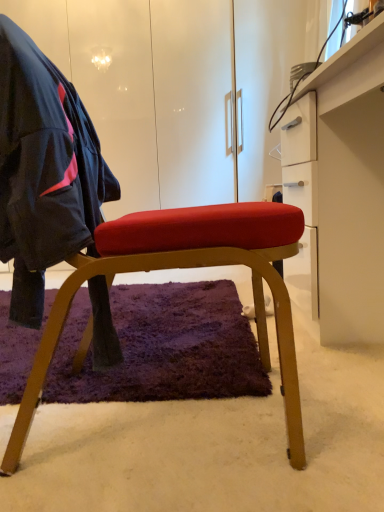
Question: Does point (54, 252) appear closer or farther from the camera than point (41, 223)?

Choices:
 (A) farther
 (B) closer

Answer: (A)

Question: Relative to matte wood chair at center, is matte black jacket at left in front or behind?

Choices:
 (A) behind
 (B) front

Answer: (B)

Question: Which of these objects is positioned farthest from the matte wood chair at center?

Choices:
 (A) matte black jacket at left
 (B) white glossy desk at right

Answer: (B)

Question: Estimate the real-world distances between objects in this image. Which object is closer to the matte wood chair at center?

Choices:
 (A) matte black jacket at left
 (B) white glossy desk at right

Answer: (A)